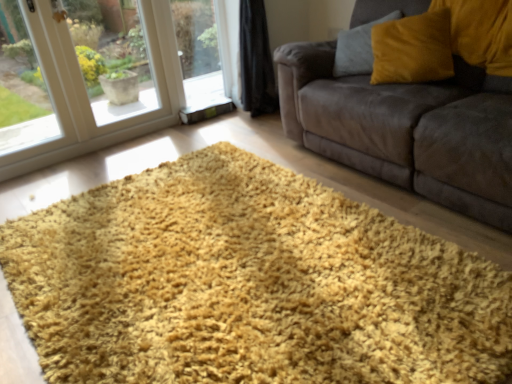
Question: Considering the positions of point (270, 243) and point (377, 112), is point (270, 243) closer or farther from the camera than point (377, 112)?

Choices:
 (A) closer
 (B) farther

Answer: (A)

Question: Is yellow shaggy rug at center situated inside velvet brown couch at center or outside?

Choices:
 (A) outside
 (B) inside

Answer: (A)

Question: Considering the real-world distances, which object is closest to the transparent glass window at lower left?

Choices:
 (A) velvet yellow pillow at upper right
 (B) yellow shaggy rug at center
 (C) velvet brown couch at center

Answer: (C)

Question: Which object is the farthest from the velvet yellow pillow at upper right?

Choices:
 (A) yellow shaggy rug at center
 (B) transparent glass window at lower left
 (C) velvet brown couch at center

Answer: (B)